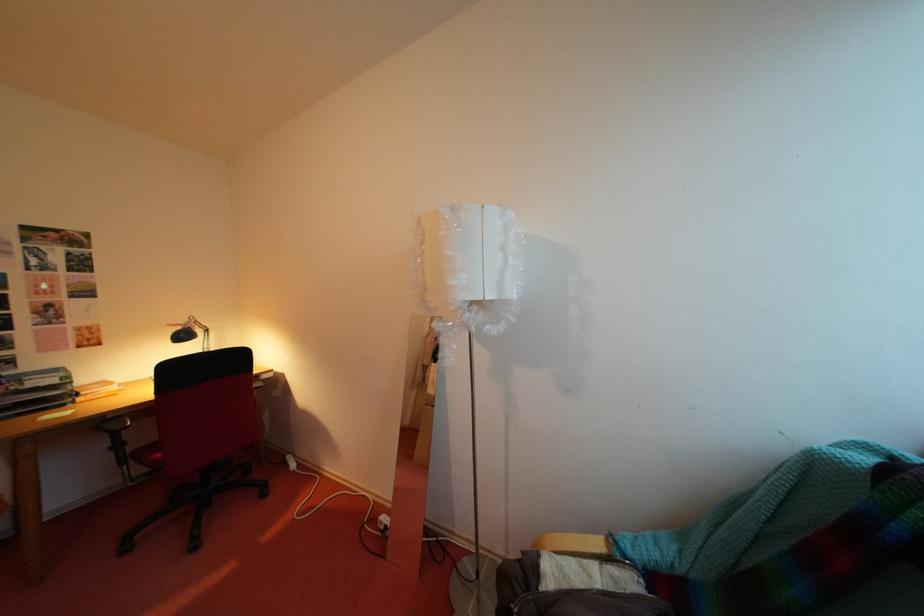
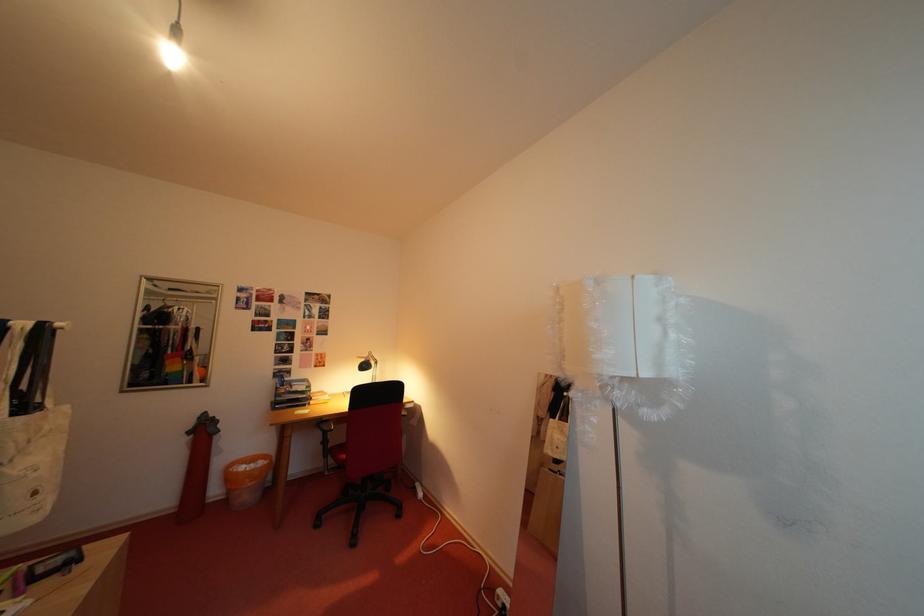
Question: The camera is either moving clockwise (left) or counter-clockwise (right) around the object. The first image is from the beginning of the video and the second image is from the end. Is the camera moving left or right when shooting the video?

Choices:
 (A) Left
 (B) Right

Answer: (B)